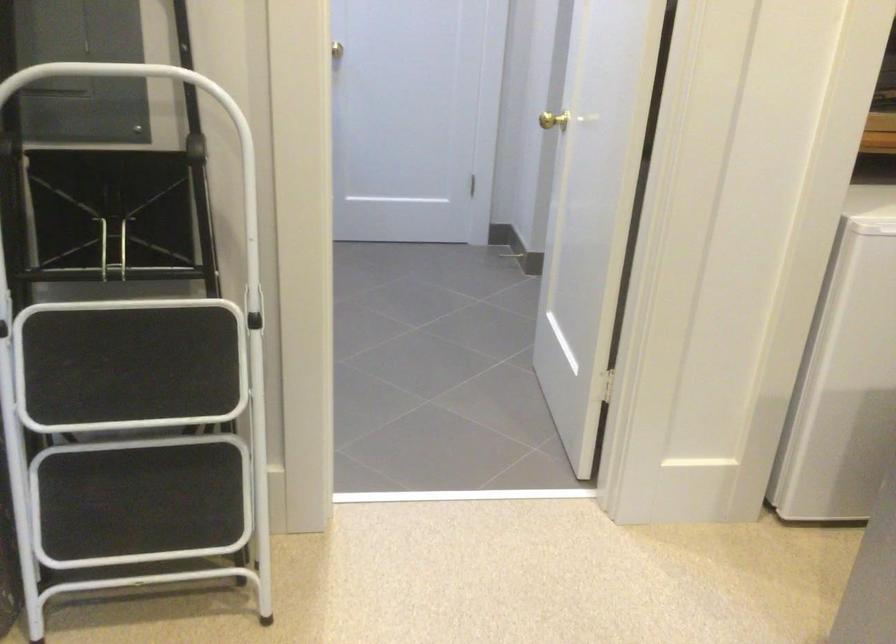
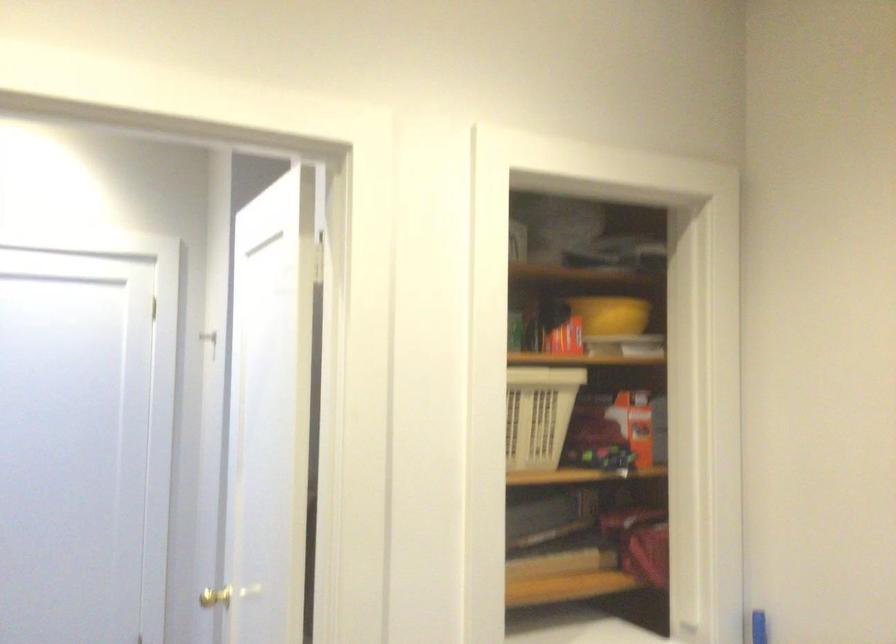
The images are taken continuously from a first-person perspective. In which direction is your viewpoint rotating?

The camera's rotation is toward right-up.